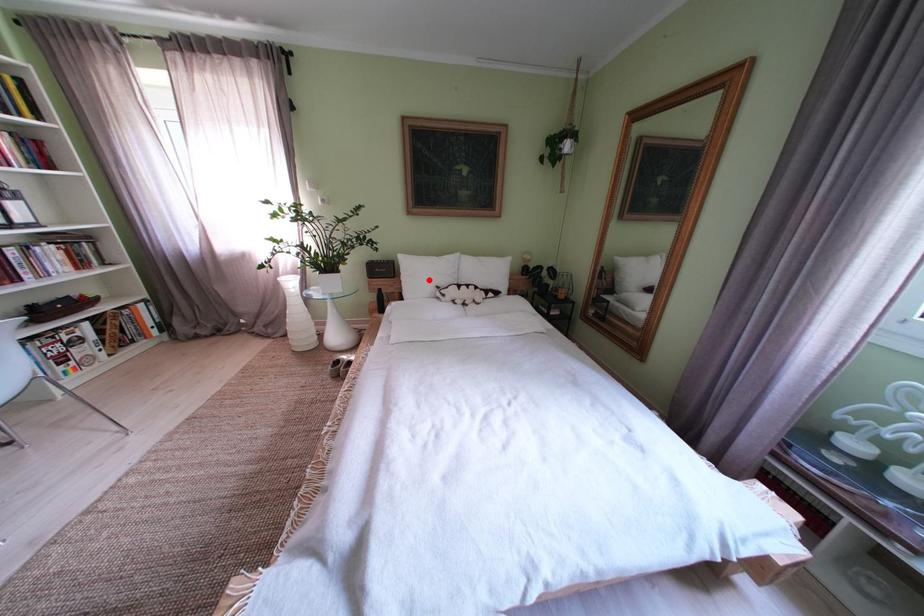
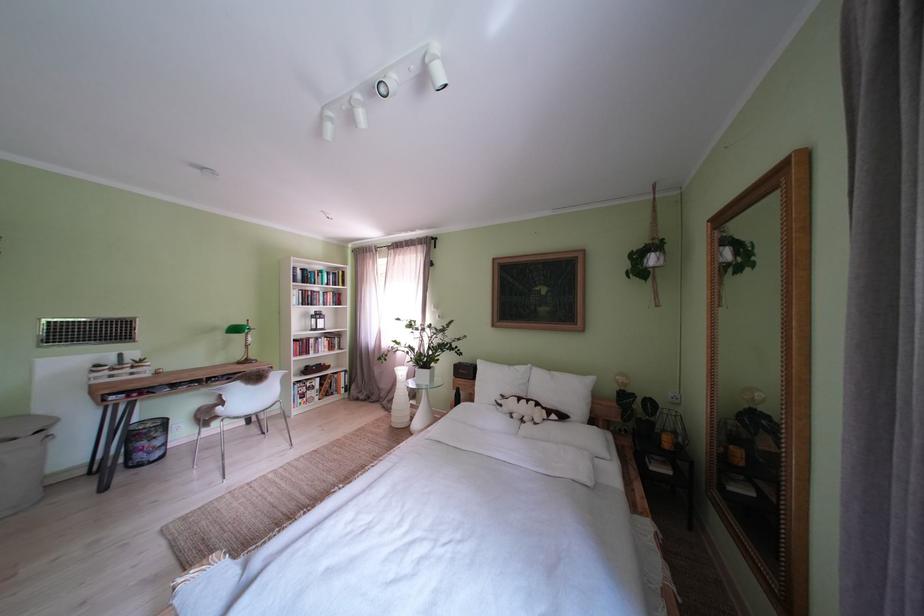
Question: A red point is marked in image1. In image2, is the corresponding 3D point closer to the camera or farther? Reply with the corresponding letter.

Choices:
 (A) The corresponding 3D point is closer.
 (B) The corresponding 3D point is farther.

Answer: (B)